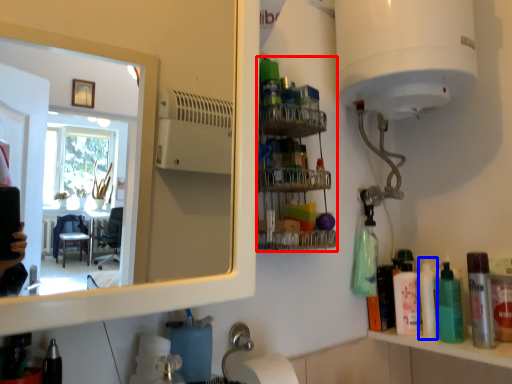
Question: Among these objects, which one is nearest to the camera, shelf (highlighted by a red box) or cleaning product (highlighted by a blue box)?

Choices:
 (A) shelf
 (B) cleaning product

Answer: (A)